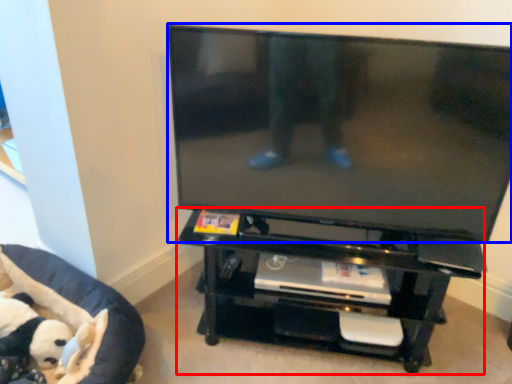
Question: Which object appears farthest to the camera in this image, entertainment center (highlighted by a red box) or television (highlighted by a blue box)?

Choices:
 (A) entertainment center
 (B) television

Answer: (A)